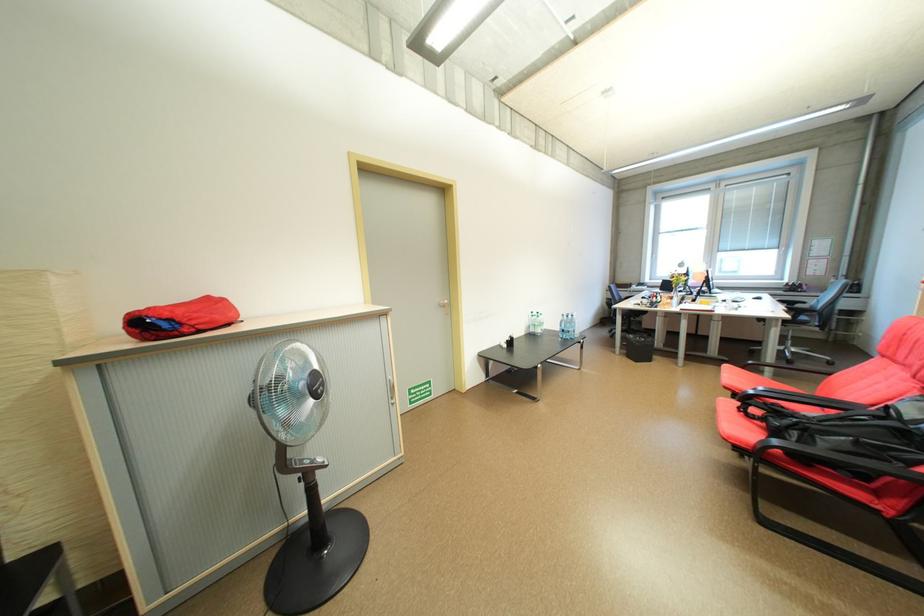
You are a GUI agent. You are given a task and a screenshot of the screen. Output one action in this format:
    pyautogui.click(x=<x>, y=<y>)
    Task: Click on the door handle
    This screenshot has height=616, width=924.
    Given the screenshot: What is the action you would take?
    pyautogui.click(x=444, y=304)